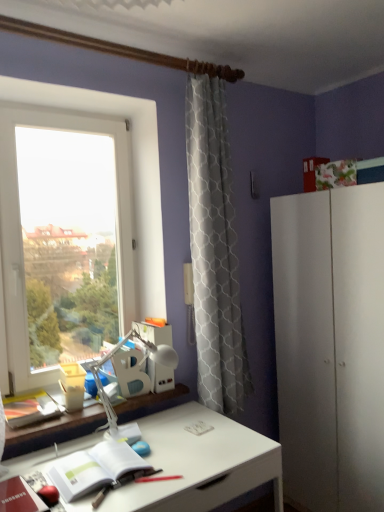
The width and height of the screenshot is (384, 512). Find the location of `empty space that is ontop of white glossy desk at center (from a real-world perspective)`. empty space that is ontop of white glossy desk at center (from a real-world perspective) is located at coordinates (129, 451).